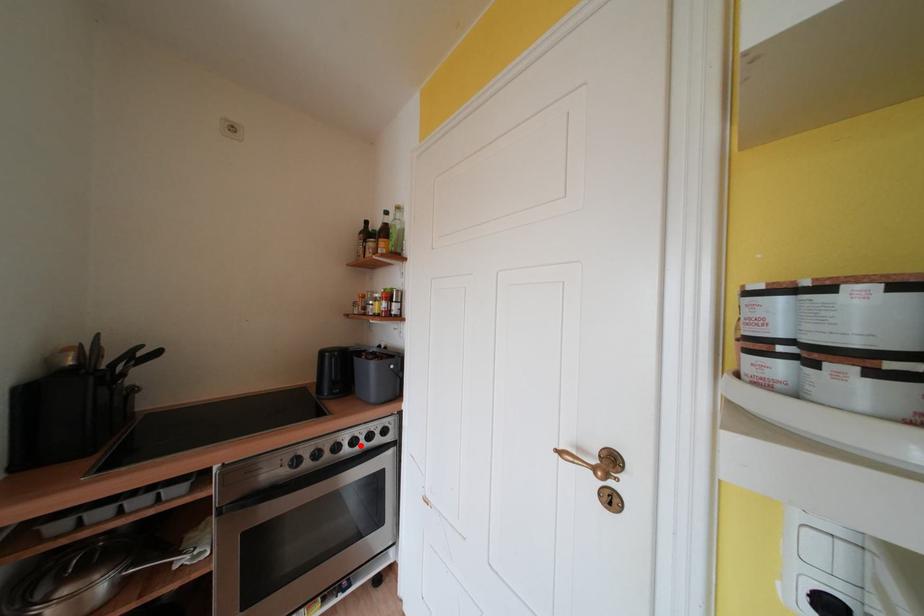
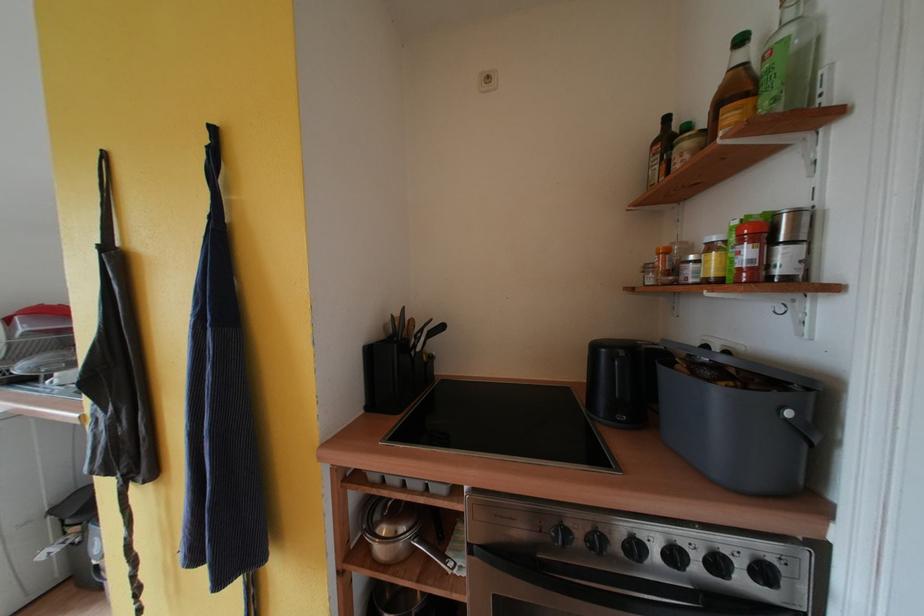
Where in the second image is the point corresponding to the highlighted location from the first image?

(681, 560)